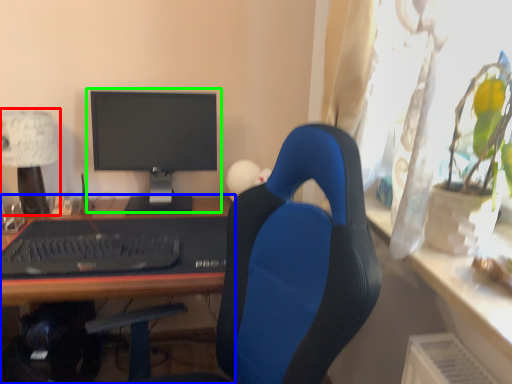
Question: Which object is positioned farthest from table lamp (highlighted by a red box)? Select from desk (highlighted by a blue box) and computer monitor (highlighted by a green box).

Choices:
 (A) desk
 (B) computer monitor

Answer: (B)